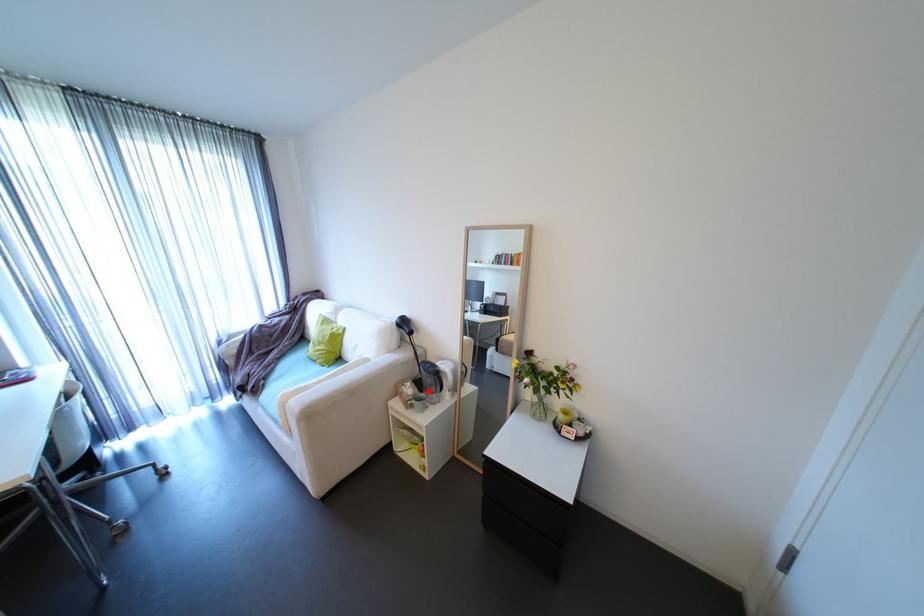
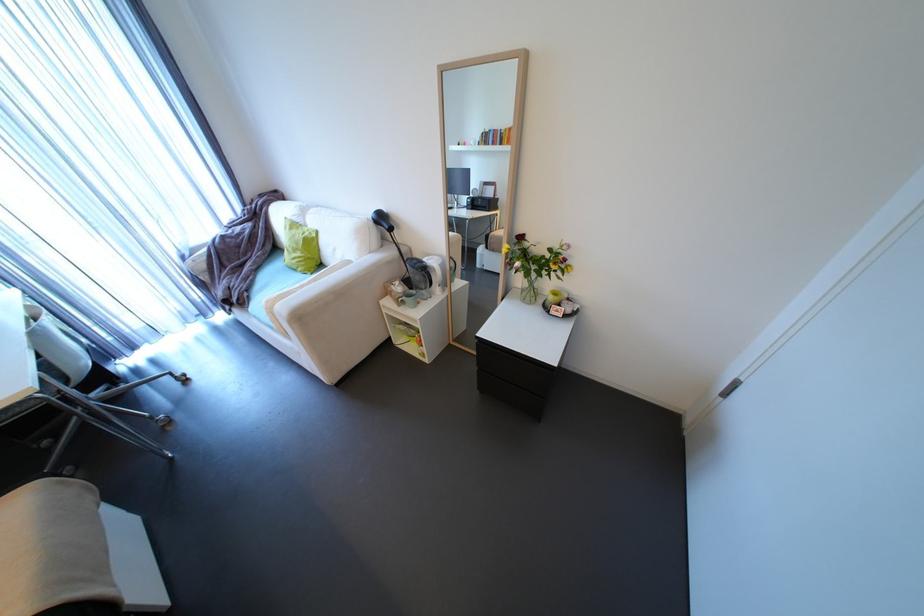
Question: I am providing you with two images of the same scene from different viewpoints. A red point is marked on the first image. Is the red point's position out of view in image 2?

Choices:
 (A) Yes
 (B) No

Answer: (B)